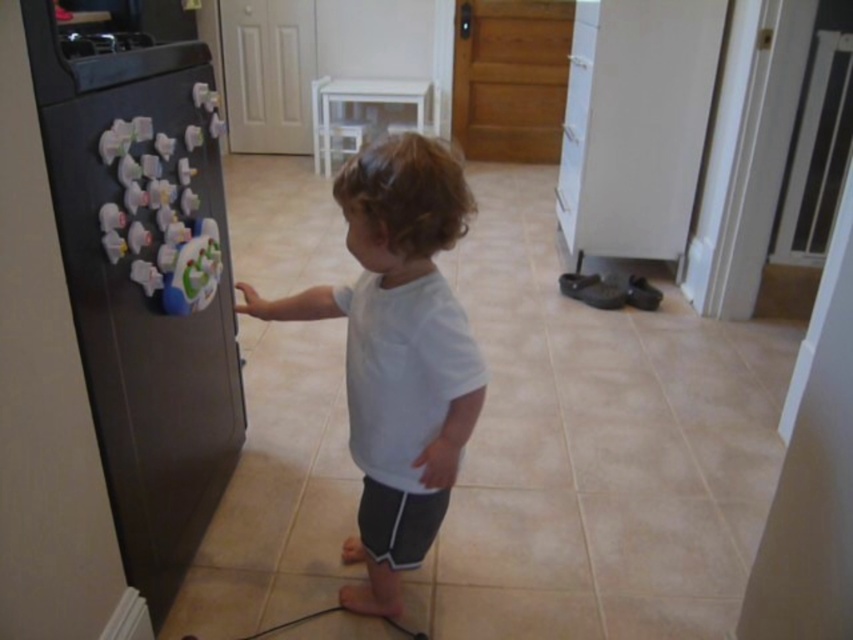
You are a parent who wants to ensure your child can safely reach the refrigerator magnets. The child is 90 centimeters tall. The black matte refrigerator at left is within the child reach. Is the refrigerator within the child reach?

The black matte refrigerator at left and viewer are 87.15 centimeters apart from each other. Since the child is 90 centimeters tall, the refrigerator is within the child reach.

You are standing in the kitchen and want to reach the point at coordinates (134,68) on the refrigerator. If your arm can extend 3 feet, will you be able to reach it?

The point at coordinates (134,68) is 3.82 feet away from you. Since your arm can only extend 3 feet, you will not be able to reach it.

Consider the image. You are a photographer trying to take a clear picture of the white matte shirt at center. However, the black matte refrigerator at left is blocking your view. Can you move the refrigerator to get a better shot?

The black matte refrigerator at left is in front of the white matte shirt at center, so moving it would allow you to see the white matte shirt at center clearly.